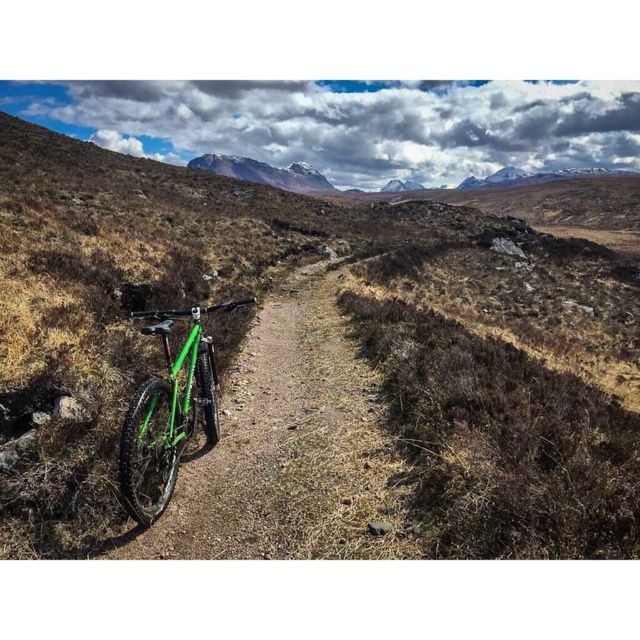
Question: Is green matte bicycle at left smaller than snowy granite mountain at upper center?

Choices:
 (A) no
 (B) yes

Answer: (A)

Question: Is green matte mountain bike at center positioned behind snowy granite mountain at upper center?

Choices:
 (A) yes
 (B) no

Answer: (B)

Question: Estimate the real-world distances between objects in this image. Which object is closer to the green matte bicycle at left?

Choices:
 (A) green matte mountain bike at center
 (B) snowy granite mountain at upper center

Answer: (A)

Question: Considering the relative positions of green matte bicycle at left and snowy granite mountain at upper center in the image provided, where is green matte bicycle at left located with respect to snowy granite mountain at upper center?

Choices:
 (A) right
 (B) left

Answer: (A)

Question: Which of these objects is positioned closest to the snowy granite mountain at upper center?

Choices:
 (A) green matte mountain bike at center
 (B) green matte bicycle at left

Answer: (B)

Question: Which of the following is the closest to the observer?

Choices:
 (A) (164, 404)
 (B) (428, 248)

Answer: (A)